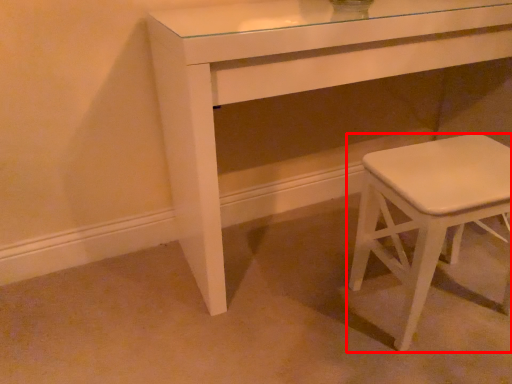
Question: In this image, where is stool (annotated by the red box) located relative to table?

Choices:
 (A) right
 (B) left

Answer: (A)